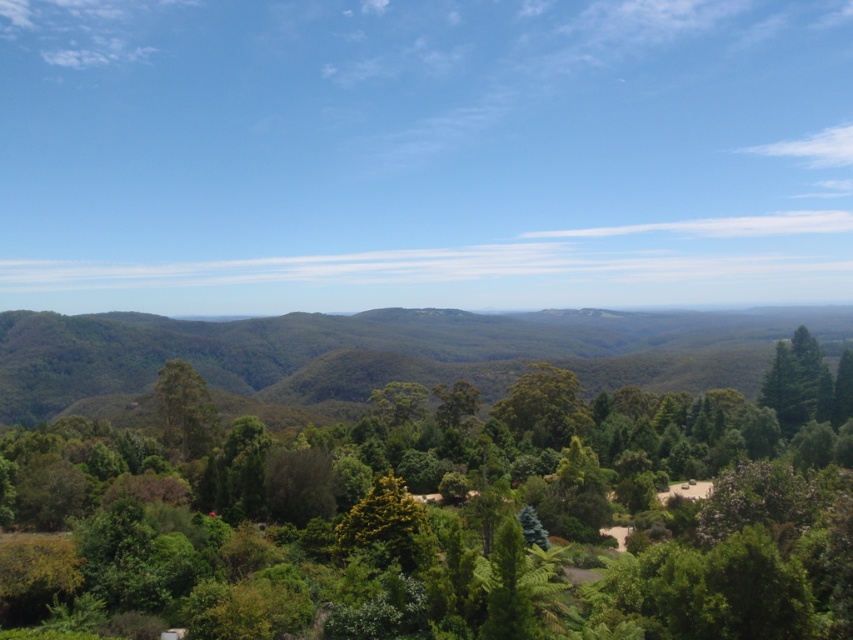
You are planning to take a photo of the green leafy forest at left and the green leafy tree at left. Which one should you focus on if you want to capture the larger subject in the frame?

The green leafy forest at left is larger in size than the green leafy tree at left, so you should focus on the green leafy forest at left to capture the larger subject in the frame.

You are standing on the dirt path in the midground of the image. You see the green leafy tree at center and the green leafy tree at left. Which tree is positioned lower in the image?

The green leafy tree at center is positioned lower in the image than the green leafy tree at left.

You are standing at the viewpoint in the image and want to reach the point marked as point (26, 420). Given that you can walk 1000 feet per hour, how long will it take you to reach there?

The distance between you and point (26, 420) is 1368.14 feet. At a walking speed of 1000 feet per hour, it would take approximately 1.368 hours, which is about 82 minutes, to reach the point.